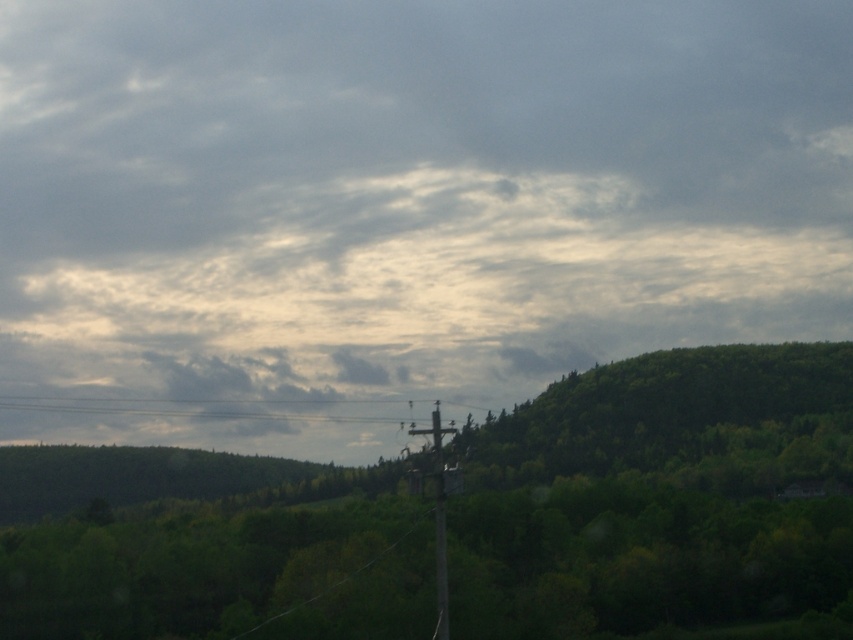
Question: Which point is closer to the camera?

Choices:
 (A) (283, 412)
 (B) (682, 193)
 (C) (210, 557)
 (D) (434, 522)

Answer: (D)

Question: Is cloudy sky at upper center above brown wooden telegraph pole at center?

Choices:
 (A) no
 (B) yes

Answer: (B)

Question: Is the position of cloudy sky at upper center more distant than that of black wire at center?

Choices:
 (A) no
 (B) yes

Answer: (A)

Question: Among these objects, which one is nearest to the camera?

Choices:
 (A) cloudy sky at upper center
 (B) brown wooden telegraph pole at center

Answer: (B)

Question: Can you confirm if cloudy sky at upper center is positioned to the left of black wire at center?

Choices:
 (A) yes
 (B) no

Answer: (B)

Question: Based on their relative distances, which object is farther from the brown wooden telegraph pole at center?

Choices:
 (A) green leafy tree at center
 (B) black wire at center
 (C) cloudy sky at upper center

Answer: (C)